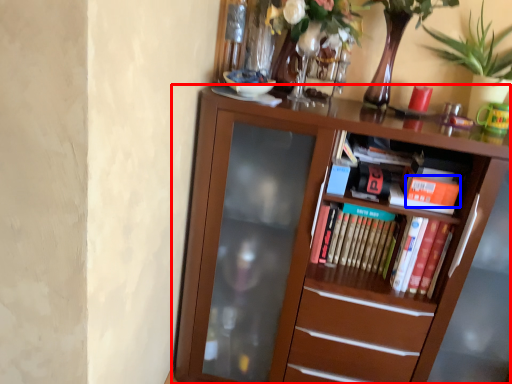
Question: Which object is closer to the camera taking this photo, bookcase (highlighted by a red box) or paperback book (highlighted by a blue box)?

Choices:
 (A) bookcase
 (B) paperback book

Answer: (A)